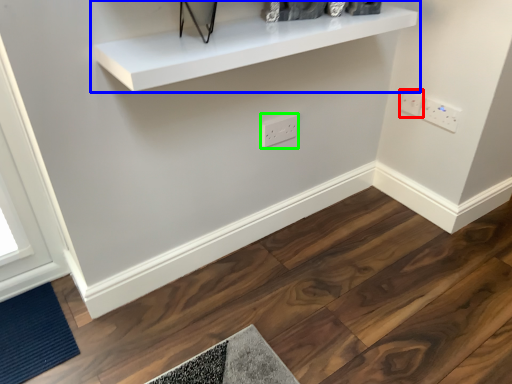
Question: Considering the real-world distances, which object is closest to electric outlet (highlighted by a red box)? shelf (highlighted by a blue box) or electric outlet (highlighted by a green box).

Choices:
 (A) shelf
 (B) electric outlet

Answer: (B)